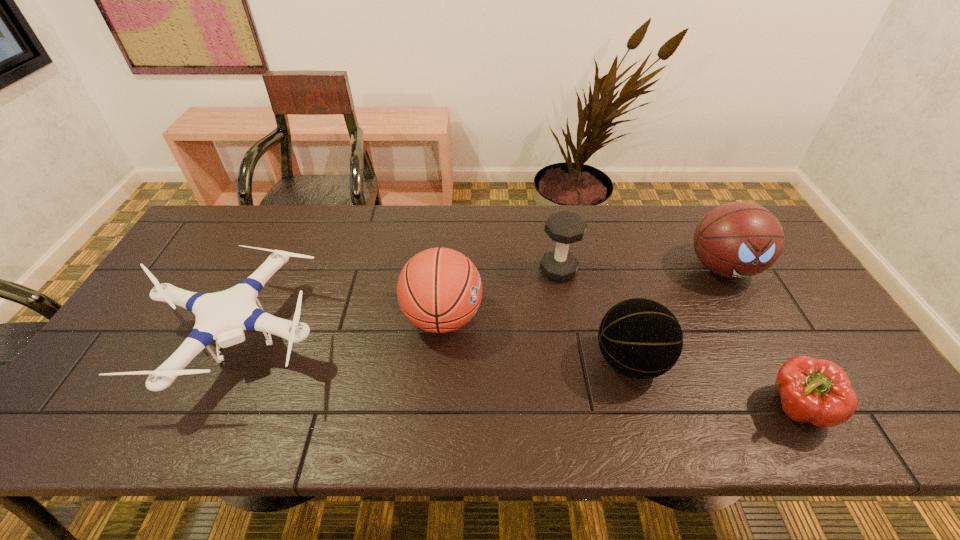
The width and height of the screenshot is (960, 540). Identify the location of free point located 0.170m on the right of the leftmost object. (394, 340).

I want to click on free region located on the left of the pepper, so click(x=696, y=409).

I want to click on object that is at the far edge, so click(738, 239).

Where is `drone that is positioned at the near edge`? This screenshot has width=960, height=540. drone that is positioned at the near edge is located at coordinates (223, 316).

Locate an element on the screen. This screenshot has height=540, width=960. pepper present at the near edge is located at coordinates (815, 391).

The width and height of the screenshot is (960, 540). I want to click on object that is at the left edge, so click(x=223, y=316).

The height and width of the screenshot is (540, 960). In order to click on basketball that is at the right edge in this screenshot , I will do `click(738, 239)`.

Identify the location of pepper present at the right edge. (815, 391).

The image size is (960, 540). Identify the location of object that is at the near left corner. (223, 316).

I want to click on object positioned at the far right corner, so click(x=738, y=239).